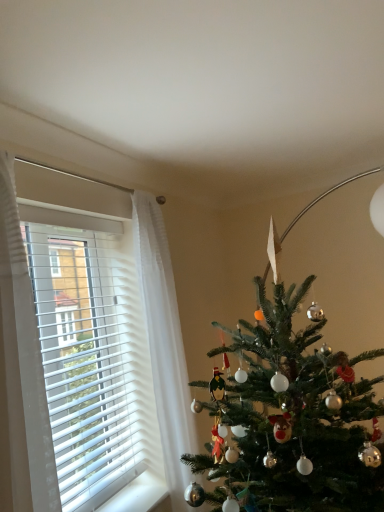
Question: From a real-world perspective, is green matte christmas tree at center located higher than green matte christmas tree at right?

Choices:
 (A) no
 (B) yes

Answer: (B)

Question: Is green matte christmas tree at center smaller than green matte christmas tree at right?

Choices:
 (A) no
 (B) yes

Answer: (B)

Question: From the image's perspective, would you say green matte christmas tree at center is shown under green matte christmas tree at right?

Choices:
 (A) no
 (B) yes

Answer: (A)

Question: From the image's perspective, would you say green matte christmas tree at center is positioned over green matte christmas tree at right?

Choices:
 (A) yes
 (B) no

Answer: (A)

Question: Can you confirm if green matte christmas tree at center is positioned to the right of green matte christmas tree at right?

Choices:
 (A) no
 (B) yes

Answer: (B)

Question: Based on their positions, is white blinds at left located to the left or right of green matte christmas tree at right?

Choices:
 (A) right
 (B) left

Answer: (B)

Question: Based on their sizes in the image, would you say white blinds at left is bigger or smaller than green matte christmas tree at right?

Choices:
 (A) small
 (B) big

Answer: (A)

Question: Choose the correct answer: Is white blinds at left inside green matte christmas tree at right or outside it?

Choices:
 (A) outside
 (B) inside

Answer: (A)

Question: Considering their positions, is white blinds at left located in front of or behind green matte christmas tree at right?

Choices:
 (A) front
 (B) behind

Answer: (B)

Question: Considering the positions of green matte christmas tree at center and white blinds at left in the image, is green matte christmas tree at center taller or shorter than white blinds at left?

Choices:
 (A) tall
 (B) short

Answer: (A)

Question: Considering the positions of point (266, 331) and point (19, 308), is point (266, 331) closer or farther from the camera than point (19, 308)?

Choices:
 (A) closer
 (B) farther

Answer: (B)

Question: Is green matte christmas tree at center bigger or smaller than white blinds at left?

Choices:
 (A) small
 (B) big

Answer: (B)

Question: From the image's perspective, is green matte christmas tree at center above or below white blinds at left?

Choices:
 (A) below
 (B) above

Answer: (A)

Question: Is point (173, 419) closer or farther from the camera than point (377, 464)?

Choices:
 (A) closer
 (B) farther

Answer: (B)

Question: Based on their sizes in the image, would you say green matte christmas tree at right is bigger or smaller than green matte christmas tree at center?

Choices:
 (A) big
 (B) small

Answer: (A)